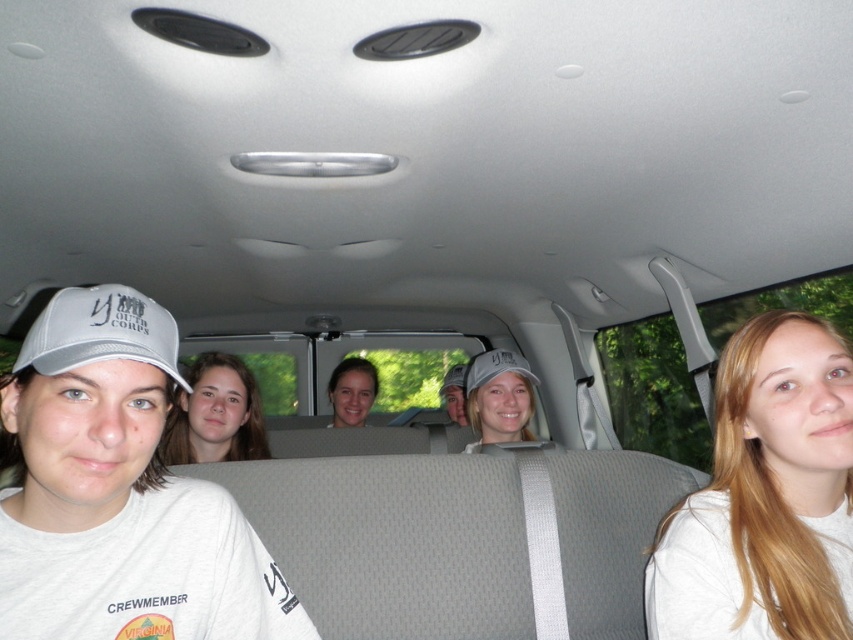
Question: Which is farther from the blonde hair at center?

Choices:
 (A) smooth skin face at center
 (B) blonde hair at right
 (C) matte gray cap at center
 (D) gray fabric baseball cap at left

Answer: (A)

Question: Is gray fabric baseball cap at left above gray fabric baseball cap at center?

Choices:
 (A) no
 (B) yes

Answer: (B)

Question: Is blonde hair at right below smooth skin face at center?

Choices:
 (A) no
 (B) yes

Answer: (A)

Question: Which point is closer to the camera?

Choices:
 (A) blonde hair at right
 (B) smooth skin face at center
 (C) matte gray cap at center

Answer: (A)

Question: Does blonde hair at right appear under gray fabric baseball cap at left?

Choices:
 (A) yes
 (B) no

Answer: (A)

Question: Which of these objects is positioned closest to the smooth skin face at center?

Choices:
 (A) blonde hair at center
 (B) blonde hair at right
 (C) matte gray cap at center

Answer: (C)